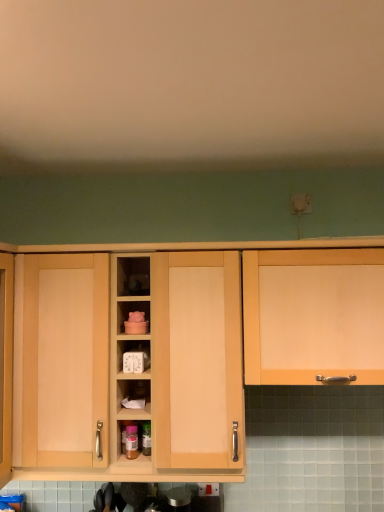
What do you see at coordinates (133, 355) in the screenshot?
I see `white plastic timer at center` at bounding box center [133, 355].

The height and width of the screenshot is (512, 384). I want to click on matte wood cabinet at right, placed as the 2th cabinetry when sorted from left to right, so click(x=259, y=303).

Considering the sizes of matte wood cabinet at right, placed as the 2th cabinetry when sorted from left to right, and light wood cabinet at center, which is the first cabinetry from left to right, in the image, is matte wood cabinet at right, placed as the 2th cabinetry when sorted from left to right, wider or thinner than light wood cabinet at center, which is the first cabinetry from left to right,?

In the image, matte wood cabinet at right, placed as the 2th cabinetry when sorted from left to right, appears to be more narrow than light wood cabinet at center, which is the first cabinetry from left to right.

From a real-world perspective, is matte wood cabinet at right, positioned as the first cabinetry in right-to-left order, below light wood cabinet at center, which is counted as the second cabinetry, starting from the right?

No, from a real-world perspective, matte wood cabinet at right, positioned as the first cabinetry in right-to-left order, is not below light wood cabinet at center, which is counted as the second cabinetry, starting from the right.

Which is farther, [321,254] or [254,295]?

The point [321,254] is more distant.

From the image's perspective, between matte wood cabinet at right, positioned as the first cabinetry in right-to-left order, and light wood cabinet at center, which is the first cabinetry from left to right, who is located below?

light wood cabinet at center, which is the first cabinetry from left to right, from the image's perspective.

Could light wood cabinet at center, which is the first cabinetry from left to right, be considered to be inside white plastic timer at center?

No, white plastic timer at center does not contain light wood cabinet at center, which is the first cabinetry from left to right.

Between white plastic timer at center and light wood cabinet at center, which is counted as the second cabinetry, starting from the right, which one has larger width?

Wider between the two is light wood cabinet at center, which is counted as the second cabinetry, starting from the right.

Does white plastic timer at center come behind light wood cabinet at center, which is counted as the second cabinetry, starting from the right?

Yes, white plastic timer at center is further from the viewer.

From a real-world perspective, is white plastic timer at center positioned above or below light wood cabinet at center, which is the first cabinetry from left to right?

white plastic timer at center is above light wood cabinet at center, which is the first cabinetry from left to right.

Is light wood cabinet at center, which is the first cabinetry from left to right, positioned far away from white plastic timer at center?

That's not correct — light wood cabinet at center, which is the first cabinetry from left to right, is a little close to white plastic timer at center.

Is point (308, 374) closer or farther from the camera than point (134, 340)?

Point (308, 374).

Do you think light wood cabinet at center, which is the first cabinetry from left to right, is within white plastic timer at center, or outside of it?

light wood cabinet at center, which is the first cabinetry from left to right, is outside white plastic timer at center.

How different are the orientations of white plastic timer at center and matte wood cabinet at right, placed as the 2th cabinetry when sorted from left to right, in degrees?

The facing directions of white plastic timer at center and matte wood cabinet at right, placed as the 2th cabinetry when sorted from left to right, are 0.000873 degrees apart.

Is white plastic timer at center bigger or smaller than matte wood cabinet at right, positioned as the first cabinetry in right-to-left order?

Clearly, white plastic timer at center is smaller in size than matte wood cabinet at right, positioned as the first cabinetry in right-to-left order.

Consider the image. Choose the correct answer: Is white plastic timer at center inside matte wood cabinet at right, placed as the 2th cabinetry when sorted from left to right, or outside it?

white plastic timer at center is outside matte wood cabinet at right, placed as the 2th cabinetry when sorted from left to right.

Between point (145, 342) and point (351, 261), which one is positioned behind?

Point (145, 342)

From the image's perspective, which is below, light wood cabinet at center, which is the first cabinetry from left to right, or matte wood cabinet at right, placed as the 2th cabinetry when sorted from left to right?

light wood cabinet at center, which is the first cabinetry from left to right, from the image's perspective.

Considering the relative sizes of light wood cabinet at center, which is the first cabinetry from left to right, and matte wood cabinet at right, placed as the 2th cabinetry when sorted from left to right, in the image provided, is light wood cabinet at center, which is the first cabinetry from left to right, thinner than matte wood cabinet at right, placed as the 2th cabinetry when sorted from left to right,?

Incorrect, the width of light wood cabinet at center, which is the first cabinetry from left to right, is not less than that of matte wood cabinet at right, placed as the 2th cabinetry when sorted from left to right.

Is light wood cabinet at center, which is the first cabinetry from left to right, far away from matte wood cabinet at right, positioned as the first cabinetry in right-to-left order?

No, there isn't a large distance between light wood cabinet at center, which is the first cabinetry from left to right, and matte wood cabinet at right, positioned as the first cabinetry in right-to-left order.

From a real-world perspective, is light wood cabinet at center, which is counted as the second cabinetry, starting from the right, located higher than matte wood cabinet at right, placed as the 2th cabinetry when sorted from left to right?

Incorrect, from a real-world perspective, light wood cabinet at center, which is counted as the second cabinetry, starting from the right, is lower than matte wood cabinet at right, placed as the 2th cabinetry when sorted from left to right.

From the image's perspective, which is above, matte wood cabinet at right, placed as the 2th cabinetry when sorted from left to right, or white plastic timer at center?

matte wood cabinet at right, placed as the 2th cabinetry when sorted from left to right, is shown above in the image.

Considering the relative positions of matte wood cabinet at right, placed as the 2th cabinetry when sorted from left to right, and white plastic timer at center in the image provided, is matte wood cabinet at right, placed as the 2th cabinetry when sorted from left to right, to the left of white plastic timer at center from the viewer's perspective?

No.

Would you say matte wood cabinet at right, positioned as the first cabinetry in right-to-left order, is outside white plastic timer at center?

Yes.

Where is `cabinetry in front of the light wood cabinet at center, which is the first cabinetry from left to right`? The width and height of the screenshot is (384, 512). cabinetry in front of the light wood cabinet at center, which is the first cabinetry from left to right is located at coordinates (259, 303).

Identify the location of cabinet behind the light wood cabinet at center, which is the first cabinetry from left to right. Image resolution: width=384 pixels, height=512 pixels. (133, 355).

Consider the image. Based on their spatial positions, is matte wood cabinet at right, positioned as the first cabinetry in right-to-left order, or white plastic timer at center closer to light wood cabinet at center, which is the first cabinetry from left to right?

matte wood cabinet at right, positioned as the first cabinetry in right-to-left order, lies closer to light wood cabinet at center, which is the first cabinetry from left to right, than the other object.

Looking at the image, which one is located further to matte wood cabinet at right, positioned as the first cabinetry in right-to-left order, white plastic timer at center or light wood cabinet at center, which is the first cabinetry from left to right?

Among the two, white plastic timer at center is located further to matte wood cabinet at right, positioned as the first cabinetry in right-to-left order.

Considering their positions, is matte wood cabinet at right, positioned as the first cabinetry in right-to-left order, positioned closer to white plastic timer at center than light wood cabinet at center, which is the first cabinetry from left to right?

Among the two, light wood cabinet at center, which is the first cabinetry from left to right, is located nearer to white plastic timer at center.

Looking at the image, which one is located closer to light wood cabinet at center, which is the first cabinetry from left to right, white plastic timer at center or matte wood cabinet at right, positioned as the first cabinetry in right-to-left order?

matte wood cabinet at right, positioned as the first cabinetry in right-to-left order, lies closer to light wood cabinet at center, which is the first cabinetry from left to right, than the other object.

From the image, which object appears to be nearer to white plastic timer at center, light wood cabinet at center, which is the first cabinetry from left to right, or matte wood cabinet at right, positioned as the first cabinetry in right-to-left order?

Based on the image, light wood cabinet at center, which is the first cabinetry from left to right, appears to be nearer to white plastic timer at center.

Estimate the real-world distances between objects in this image. Which object is closer to matte wood cabinet at right, positioned as the first cabinetry in right-to-left order, light wood cabinet at center, which is the first cabinetry from left to right, or white plastic timer at center?

light wood cabinet at center, which is the first cabinetry from left to right.

Identify the location of cabinet situated between light wood cabinet at center, which is the first cabinetry from left to right, and matte wood cabinet at right, placed as the 2th cabinetry when sorted from left to right, from left to right. Image resolution: width=384 pixels, height=512 pixels. (133, 355).